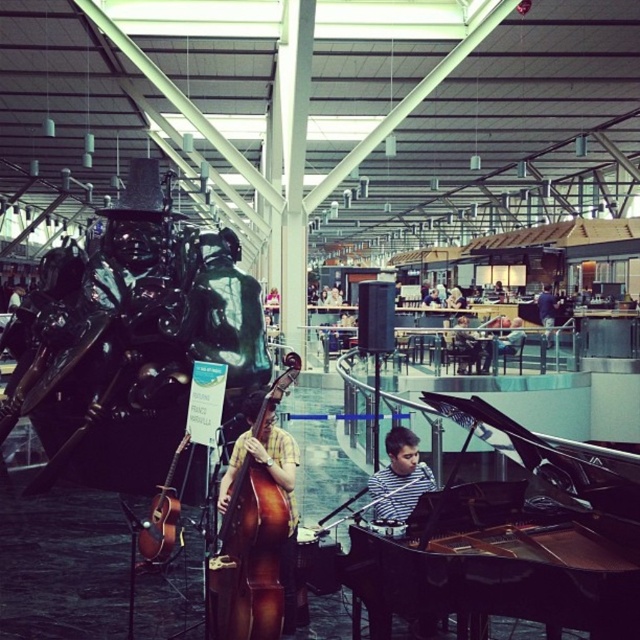
Who is shorter, black polished piano at center or striped fabric at center?

striped fabric at center

From the picture: Can you confirm if black polished piano at center is taller than striped fabric at center?

Yes.

What do you see at coordinates (500, 564) in the screenshot? I see `black polished piano at center` at bounding box center [500, 564].

Where is `black polished piano at center`? Image resolution: width=640 pixels, height=640 pixels. black polished piano at center is located at coordinates (500, 564).

Is wooden polished cello at center thinner than matte brown guitar at lower left?

In fact, wooden polished cello at center might be wider than matte brown guitar at lower left.

The height and width of the screenshot is (640, 640). What do you see at coordinates (253, 528) in the screenshot?
I see `wooden polished cello at center` at bounding box center [253, 528].

This screenshot has width=640, height=640. Identify the location of wooden polished cello at center. (253, 528).

The height and width of the screenshot is (640, 640). I want to click on black polished piano at center, so click(x=500, y=564).

Is black polished piano at center smaller than matte brown guitar at lower left?

Actually, black polished piano at center might be larger than matte brown guitar at lower left.

Is point (477, 403) positioned behind point (154, 529)?

That is False.

This screenshot has height=640, width=640. What are the coordinates of `black polished piano at center` in the screenshot? It's located at (500, 564).